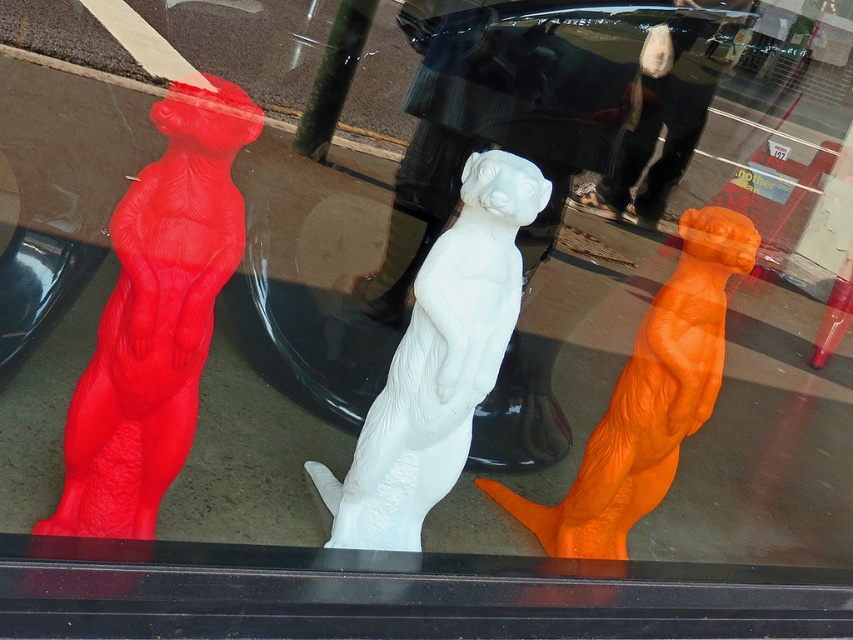
Question: Which object appears farthest from the camera in this image?

Choices:
 (A) white matte otter at center
 (B) matte red statue at left
 (C) orange matte otter at center

Answer: (C)

Question: Where is white matte otter at center located in relation to orange matte otter at center in the image?

Choices:
 (A) left
 (B) right

Answer: (A)

Question: Which object appears closest to the camera in this image?

Choices:
 (A) orange matte otter at center
 (B) matte red statue at left
 (C) white matte otter at center

Answer: (B)

Question: Does matte red statue at left appear under orange matte otter at center?

Choices:
 (A) no
 (B) yes

Answer: (A)

Question: Is white matte otter at center closer to the viewer compared to orange matte otter at center?

Choices:
 (A) no
 (B) yes

Answer: (B)

Question: Estimate the real-world distances between objects in this image. Which object is closer to the orange matte otter at center?

Choices:
 (A) white matte otter at center
 (B) matte red statue at left

Answer: (A)